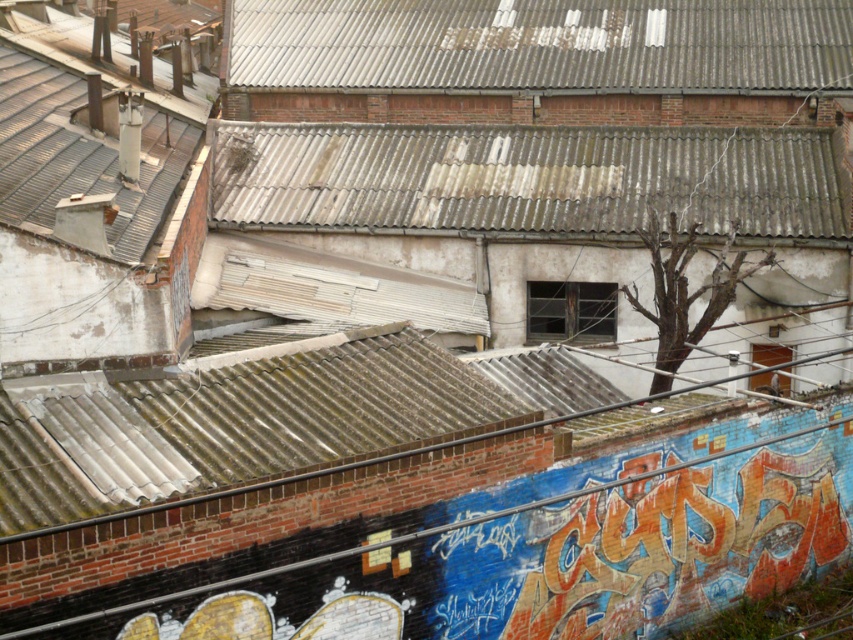
Question: Considering the real-world distances, which object is farthest from the rusty metal chimney at upper left?

Choices:
 (A) rusty corrugated metal roof at center
 (B) rusty corrugated metal roof at upper center

Answer: (A)

Question: Which object is farther from the camera taking this photo?

Choices:
 (A) weathered metal roof at upper center
 (B) rusty metal chimney at upper left

Answer: (A)

Question: Can you confirm if rusty corrugated metal roof at center is positioned above rusty metal chimney at upper left?

Choices:
 (A) no
 (B) yes

Answer: (A)

Question: Is weathered metal roof at upper center above rusty corrugated metal roof at upper center?

Choices:
 (A) no
 (B) yes

Answer: (A)

Question: From the image, what is the correct spatial relationship of weathered metal roof at upper center in relation to rusty metal chimney at upper left?

Choices:
 (A) right
 (B) left

Answer: (A)

Question: Which object appears closest to the camera in this image?

Choices:
 (A) rusty corrugated metal roof at upper center
 (B) weathered metal roof at upper center

Answer: (B)